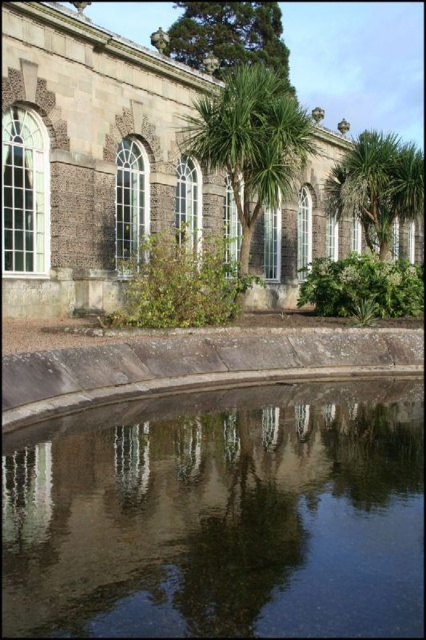
Question: Which of the following is the closest to the observer?

Choices:
 (A) (368, 616)
 (B) (250, 33)

Answer: (A)

Question: Is green leafy palm tree at right further to the viewer compared to green leafy tree at upper center?

Choices:
 (A) no
 (B) yes

Answer: (A)

Question: Does green leafy palm tree at center come in front of green leafy palm tree at right?

Choices:
 (A) yes
 (B) no

Answer: (A)

Question: Where is transparent glass water at center located in relation to green leafy tree at upper center in the image?

Choices:
 (A) below
 (B) above

Answer: (A)

Question: Which point is closer to the camera?

Choices:
 (A) (273, 520)
 (B) (204, 109)
 (C) (175, 36)

Answer: (A)

Question: Which point is farther from the camera taking this photo?

Choices:
 (A) (414, 195)
 (B) (325, 474)
 (C) (218, 54)
 (D) (244, 212)

Answer: (C)